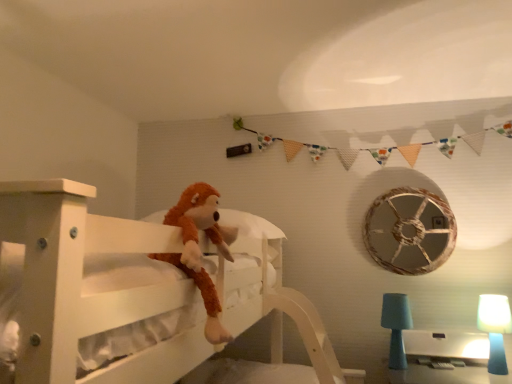
Question: Is teal fabric lampshade at lower right, marked as the 2th table lamp in a right-to-left arrangement, inside or outside of brown plush toy at center?

Choices:
 (A) outside
 (B) inside

Answer: (A)

Question: Relative to brown plush toy at center, is teal fabric lampshade at lower right, marked as the 2th table lamp in a right-to-left arrangement, in front or behind?

Choices:
 (A) front
 (B) behind

Answer: (B)

Question: Which of these objects is positioned closest to the rustic wood wheel at upper right?

Choices:
 (A) teal fabric lampshade at lower right, the 1th table lamp from the left
 (B) blue matte table lamp at lower right, the second table lamp positioned from the left
 (C) brown plush toy at center
 (D) white wooden bed at center
 (E) white glossy table at lower right

Answer: (A)

Question: Which object is the closest to the brown plush toy at center?

Choices:
 (A) teal fabric lampshade at lower right, the 1th table lamp from the left
 (B) white glossy table at lower right
 (C) white wooden bed at center
 (D) blue matte table lamp at lower right, the second table lamp positioned from the left
 (E) rustic wood wheel at upper right

Answer: (C)